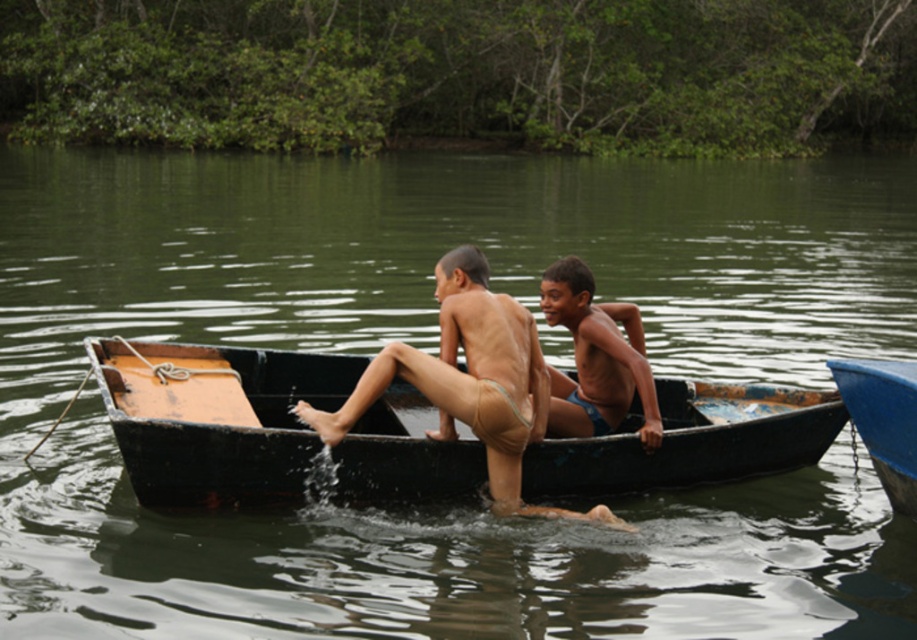
You are a photographer trying to capture both the blue fabric shorts at center and the blue glossy canoe at right in a single frame. Based on their sizes, which object should you focus on to ensure both fit within the camera view?

The blue fabric shorts at center is wider than the blue glossy canoe at right, so focusing on the blue fabric shorts at center will ensure both objects fit within the camera view.

From the picture: You are a photographer trying to capture both the rusty metal canoe at center and the blue glossy canoe at right in a single shot. Based on their positions, which canoe should you focus on first to ensure both are in frame?

You should focus on the rusty metal canoe at center first since it is positioned to the left of the blue glossy canoe at right, allowing you to frame both canoes by adjusting the camera to include both left and right elements.